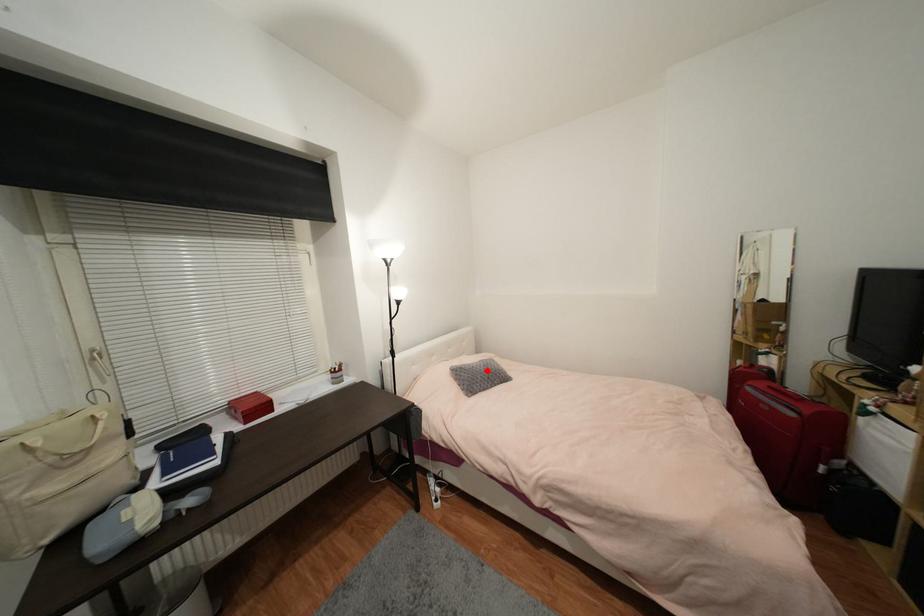
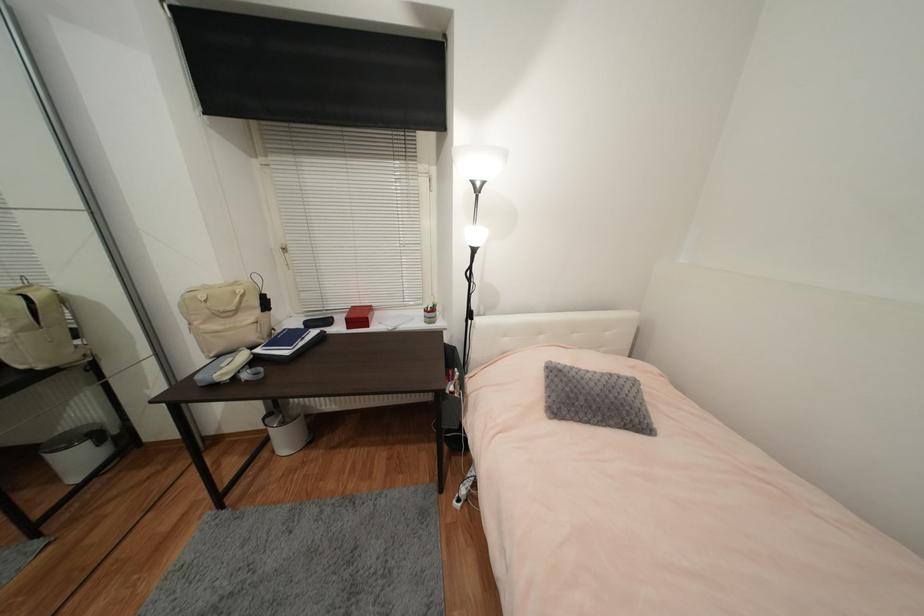
The point at the highlighted location is marked in the first image. Where is the corresponding point in the second image?

(602, 391)